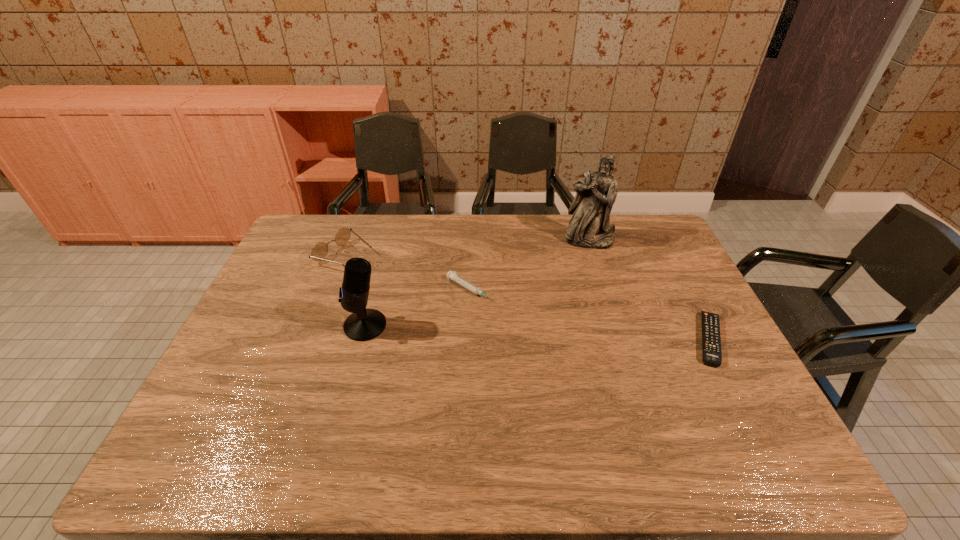
At what (x,y) coordinates should I click in order to perform the action: click on free space on the desktop that is between the fourth shortest object and the rightmost object and is positioned on the front-facing side of the third tallest object. Please return your answer as a coordinate pair (x, y). Looking at the image, I should click on (499, 330).

Locate an element on the screen. This screenshot has width=960, height=540. free spot on the desktop that is between the fourth shortest object and the remote control and is positioned at the needle end of the second shortest object is located at coordinates (541, 333).

This screenshot has height=540, width=960. I want to click on free space on the desktop that is between the microphone and the shortest object and is positioned on the front-facing side of the fourth object from left to right, so click(581, 334).